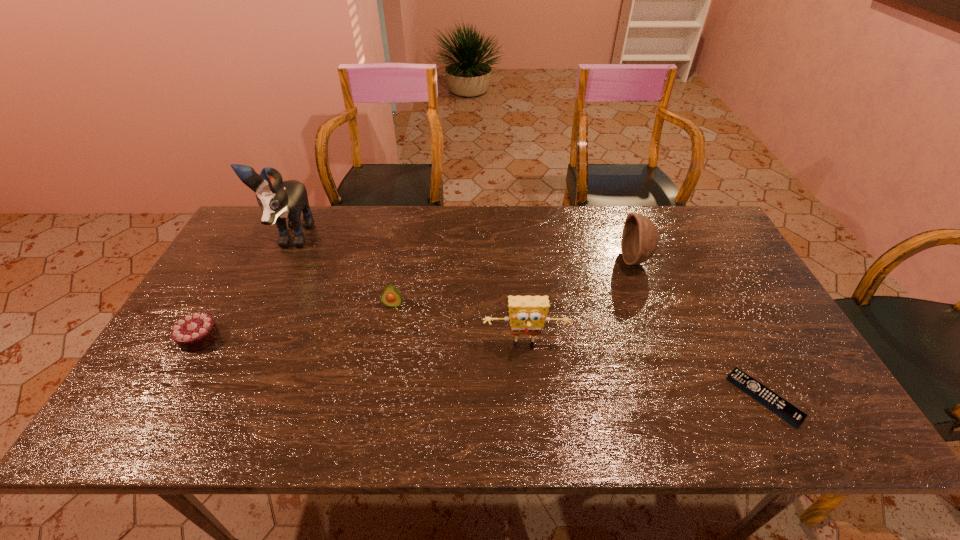
Find the location of a particular element. This screenshot has height=540, width=960. object that is the third closest to the remote control is located at coordinates (391, 297).

This screenshot has height=540, width=960. Identify the location of object that stands as the fifth closest to the sponge. (194, 332).

This screenshot has height=540, width=960. In order to click on free location that satisfies the following two spatial constraints: 1. on the front-facing side of the rightmost object; 2. on the left side of the tallest object in this screenshot , I will do pyautogui.click(x=214, y=398).

You are a GUI agent. You are given a task and a screenshot of the screen. Output one action in this format:
    pyautogui.click(x=<x>, y=<y>)
    Task: Click on the free space that satisfies the following two spatial constraints: 1. on the front-facing side of the puppy; 2. on the left side of the fifth object from left to right
    Image resolution: width=960 pixels, height=540 pixels.
    Given the screenshot: What is the action you would take?
    pyautogui.click(x=281, y=260)

Locate an element on the screen. vacant space that satisfies the following two spatial constraints: 1. on the front-facing side of the fifth object from right to left; 2. on the right side of the bowl is located at coordinates (281, 260).